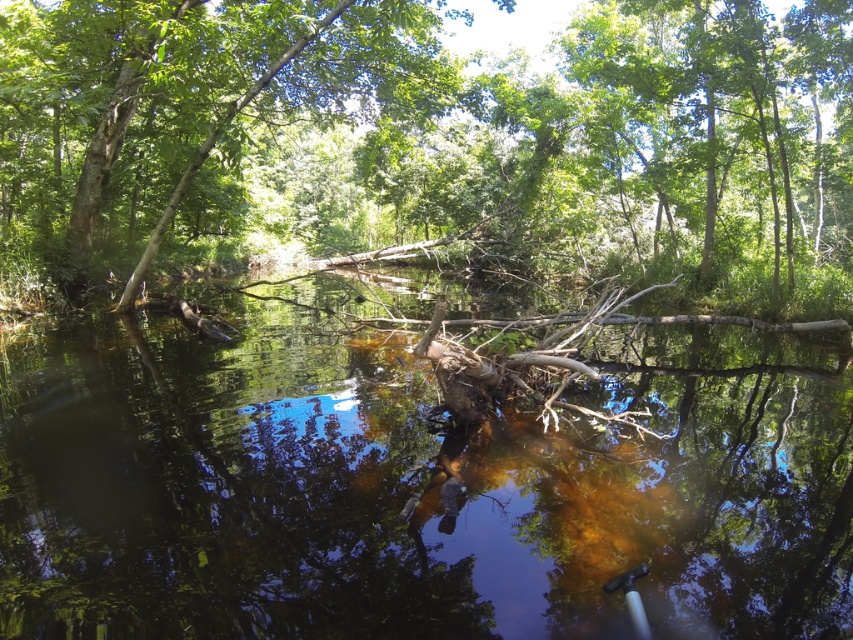
Question: Which point is farther to the camera?

Choices:
 (A) (734, 35)
 (B) (202, 428)

Answer: (A)

Question: Which of the following is the closest to the observer?

Choices:
 (A) green leafy tree at center
 (B) brown murky water at center

Answer: (B)

Question: Can you confirm if brown murky water at center is wider than green leafy tree at center?

Choices:
 (A) no
 (B) yes

Answer: (A)

Question: Does brown murky water at center lie behind green leafy tree at center?

Choices:
 (A) no
 (B) yes

Answer: (A)

Question: Is brown murky water at center in front of green leafy tree at center?

Choices:
 (A) no
 (B) yes

Answer: (B)